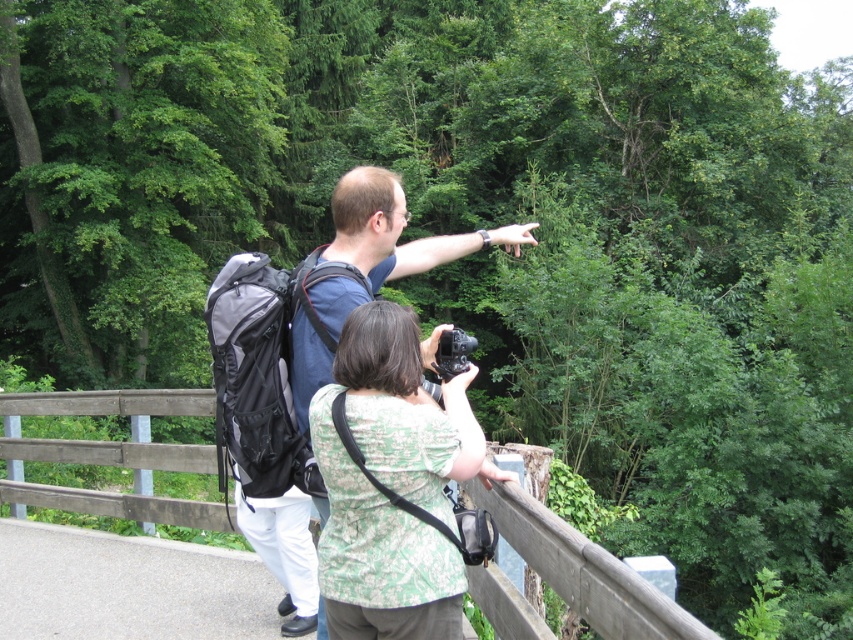
You are a photographer trying to capture both the matte blue shirt at center and the black plastic camera at center in a single frame. Considering their heights, which object will appear larger in the photo?

The matte blue shirt at center is much taller than the black plastic camera at center, so it will appear larger in the photo.

Please describe the object located at point (585, 570) in the image.

The object at point (585, 570) is wooden at upper center.